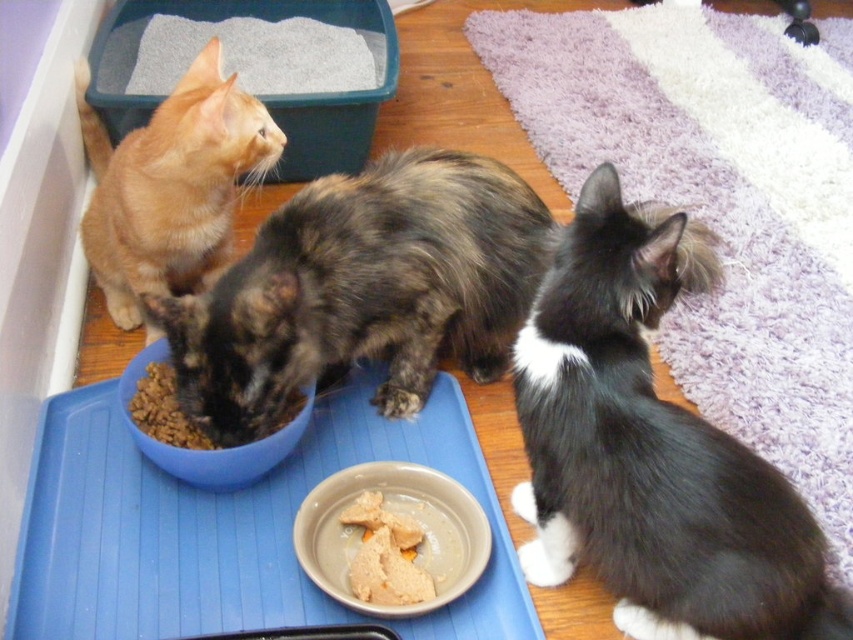
Question: Does black and white fur cat at right appear over matte gray bowl at lower center?

Choices:
 (A) yes
 (B) no

Answer: (A)

Question: Based on their relative distances, which object is nearer to the black and white fur cat at right?

Choices:
 (A) fluffy tortoiseshell cat at center
 (B) soft textured cat food at center
 (C) matte gray bowl at lower center
 (D) blue plastic bowl at center

Answer: (C)

Question: Is blue plastic tray at center positioned in front of dry kibble at center?

Choices:
 (A) yes
 (B) no

Answer: (A)

Question: Based on their relative distances, which object is farther from the dry kibble at center?

Choices:
 (A) soft textured cat food at center
 (B) black and white fur cat at right
 (C) fluffy tortoiseshell cat at center

Answer: (B)

Question: Which point is farther from the camera taking this photo?

Choices:
 (A) (424, 605)
 (B) (311, 390)

Answer: (B)

Question: Where is blue plastic tray at center located in relation to dry kibble at center in the image?

Choices:
 (A) right
 (B) left

Answer: (A)